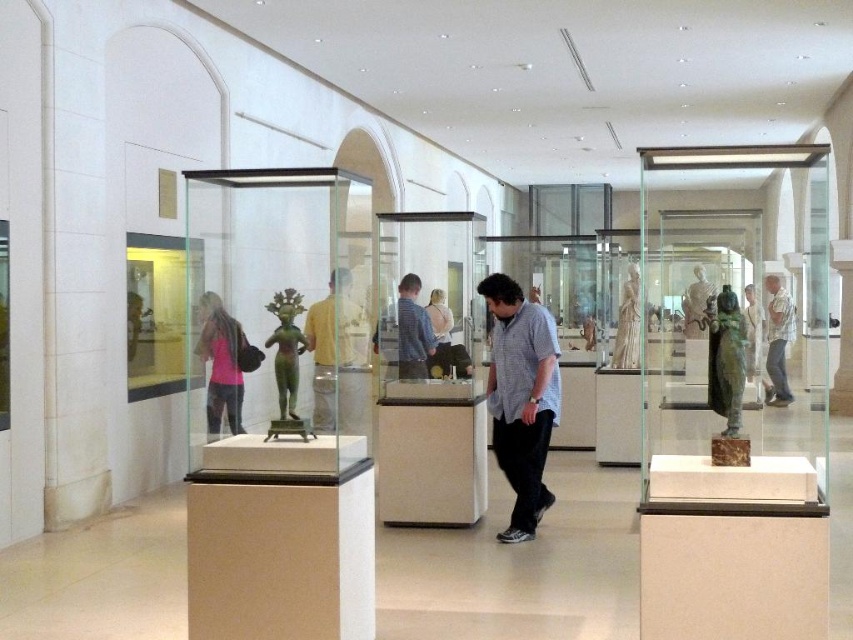
Question: Is light blue plaid shirt at center in front of green marble statue at center?

Choices:
 (A) yes
 (B) no

Answer: (B)

Question: Which of these objects is positioned closest to the green polished stone statue at center?

Choices:
 (A) green marble statue at center
 (B) matte yellow shirt at center

Answer: (B)

Question: Is green polished stone statue at center positioned at the back of green marble statue at center?

Choices:
 (A) no
 (B) yes

Answer: (B)

Question: Is matte yellow shirt at center in front of light blue plaid shirt at center?

Choices:
 (A) no
 (B) yes

Answer: (B)

Question: Which of the following is the farthest from the observer?

Choices:
 (A) (225, 410)
 (B) (496, 445)

Answer: (B)

Question: Which point is farther to the camera?

Choices:
 (A) matte yellow shirt at center
 (B) green polished stone statue at center
 (C) pink fabric bag at center
 (D) blue plaid shirt at center

Answer: (D)